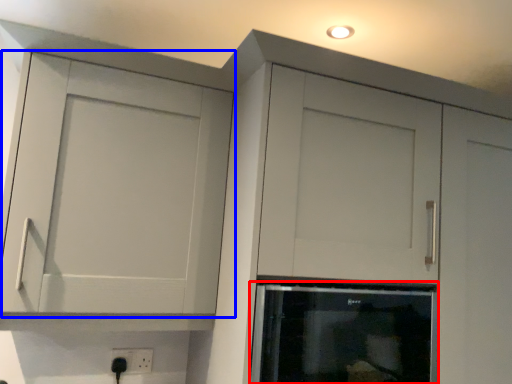
Question: Which point is closer to the camera, appliance (highlighted by a red box) or cupboard (highlighted by a blue box)?

Choices:
 (A) appliance
 (B) cupboard

Answer: (B)